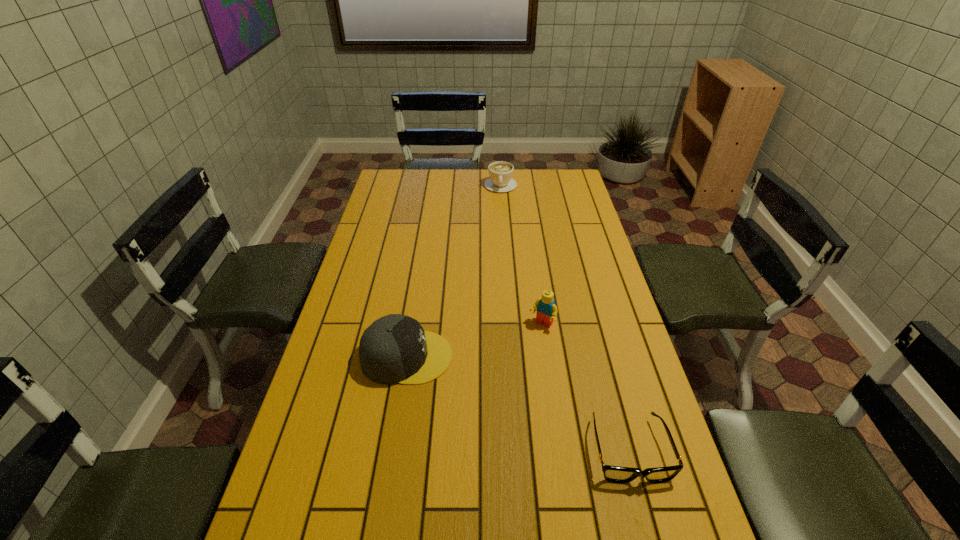
You are a GUI agent. You are given a task and a screenshot of the screen. Output one action in this format:
    pyautogui.click(x=<x>, y=<y>)
    Task: Click on the unoccupied position between the cappuccino and the rightmost object
    The width and height of the screenshot is (960, 540).
    Given the screenshot: What is the action you would take?
    pyautogui.click(x=564, y=318)

I want to click on vacant point located between the second shortest object and the cap, so click(x=454, y=271).

Select which object appears as the third closest to the cap. Please provide its 2D coordinates. Your answer should be formatted as a tuple, i.e. [(x, y)], where the tuple contains the x and y coordinates of a point satisfying the conditions above.

[(500, 172)]

Find the location of a particular element. The width and height of the screenshot is (960, 540). object that stands as the second closest to the sunglasses is located at coordinates (394, 349).

You are a GUI agent. You are given a task and a screenshot of the screen. Output one action in this format:
    pyautogui.click(x=<x>, y=<y>)
    Task: Click on the vacant space that satisfies the following two spatial constraints: 1. on the front side of the cappuccino; 2. on the right side of the Lego
    This screenshot has width=960, height=540.
    Given the screenshot: What is the action you would take?
    pyautogui.click(x=510, y=325)